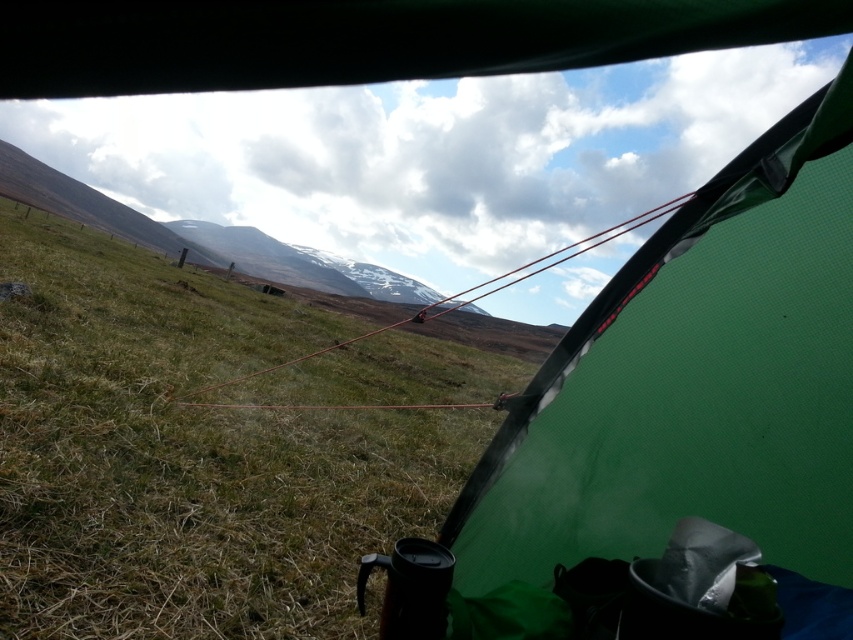
Is point (80, 454) less distant than point (733, 362)?

No.

Does green grassy at lower left have a greater height compared to green mesh tent at center?

Yes.

Identify the location of green grassy at lower left. (189, 456).

You are a GUI agent. You are given a task and a screenshot of the screen. Output one action in this format:
    pyautogui.click(x=<x>, y=<y>)
    Task: Click on the green grassy at lower left
    The image size is (853, 640).
    Given the screenshot: What is the action you would take?
    pyautogui.click(x=189, y=456)